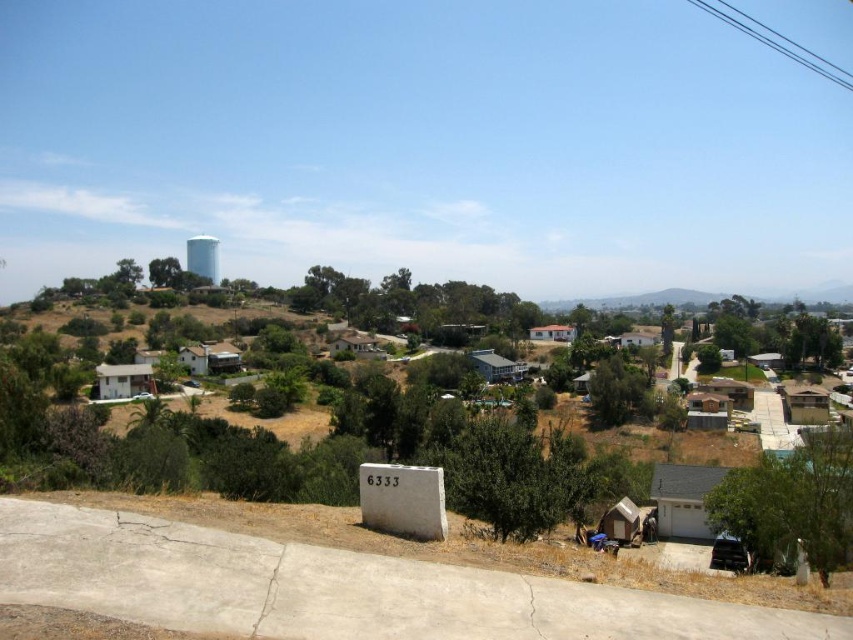
You are standing at the white sign with the number 6333 at the edge of the driveway. You see two points marked in the image, point (x=851, y=468) and point (x=494, y=291). Which point is closer to you?

Point (x=851, y=468) is in front of point (x=494, y=291), so it is closer to you.

You are a gardener planning to plant a new tree in the suburban landscape. You notice the green leafy tree at lower right and the green leafy tree at center. Which tree would require more space for its root system?

The green leafy tree at center requires more space for its root system because it is larger than the green leafy tree at lower right.